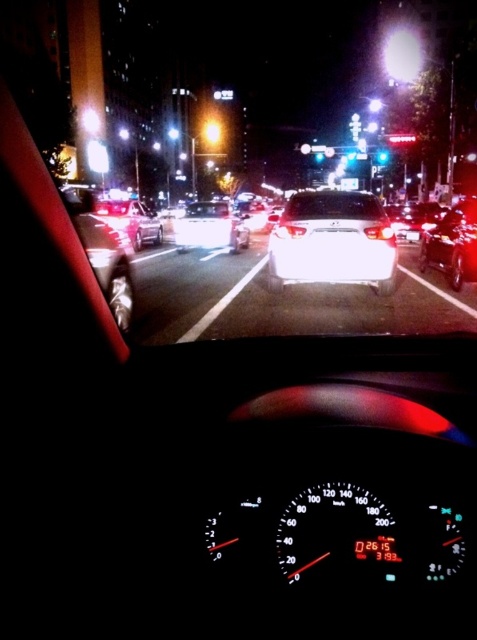
Does shiny black sedan at right have a larger size compared to bright white light at upper center?

No.

Does point (442, 248) lie behind point (417, 36)?

No, (442, 248) is closer to viewer.

Between point (439, 262) and point (418, 44), which one is positioned in front?

Point (439, 262) is more forward.

What are the coordinates of `shiny black sedan at right` in the screenshot? It's located at (452, 243).

Does white glossy sedan at center have a larger size compared to shiny silver sedan at center?

Actually, white glossy sedan at center might be smaller than shiny silver sedan at center.

The height and width of the screenshot is (640, 477). What do you see at coordinates (332, 241) in the screenshot? I see `white glossy sedan at center` at bounding box center [332, 241].

Find the location of a particular element. The image size is (477, 640). white glossy sedan at center is located at coordinates (332, 241).

What do you see at coordinates (210, 227) in the screenshot? The width and height of the screenshot is (477, 640). I see `shiny silver sedan at center` at bounding box center [210, 227].

Can you confirm if shiny silver sedan at center is positioned below clear glass windshield at center?

Actually, shiny silver sedan at center is above clear glass windshield at center.

This screenshot has height=640, width=477. Find the location of `shiny silver sedan at center`. shiny silver sedan at center is located at coordinates (210, 227).